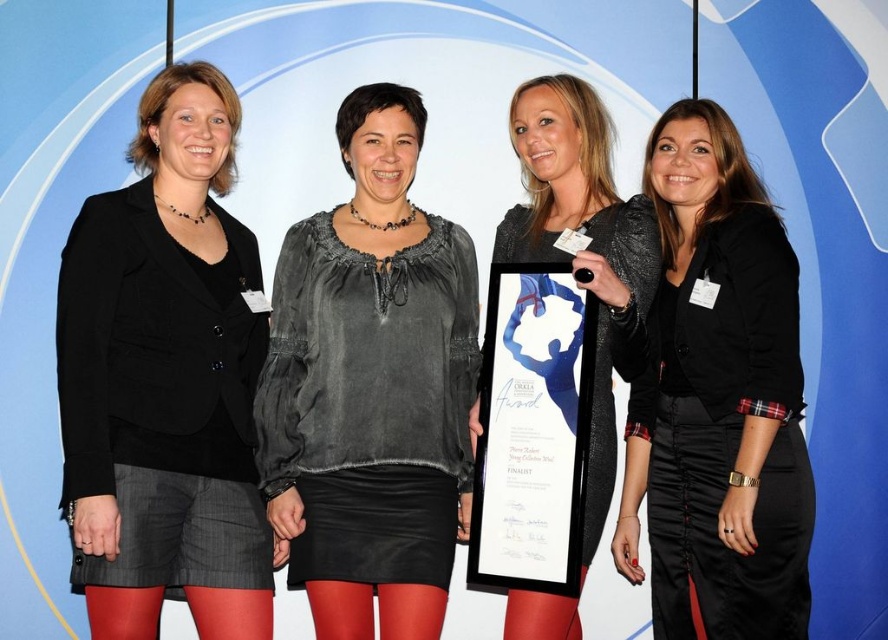
Based on the scene description, which object is located below the other between the matte black blazer at left and the matte black dress at center?

The matte black blazer at left is positioned under the matte black dress at center.